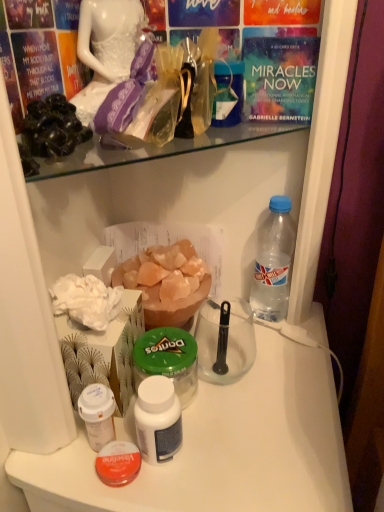
This screenshot has width=384, height=512. Identify the location of vacant space that is in between clear plastic bottle at right, the first bottle when ordered from right to left, and pink crystal salt at center. (233, 326).